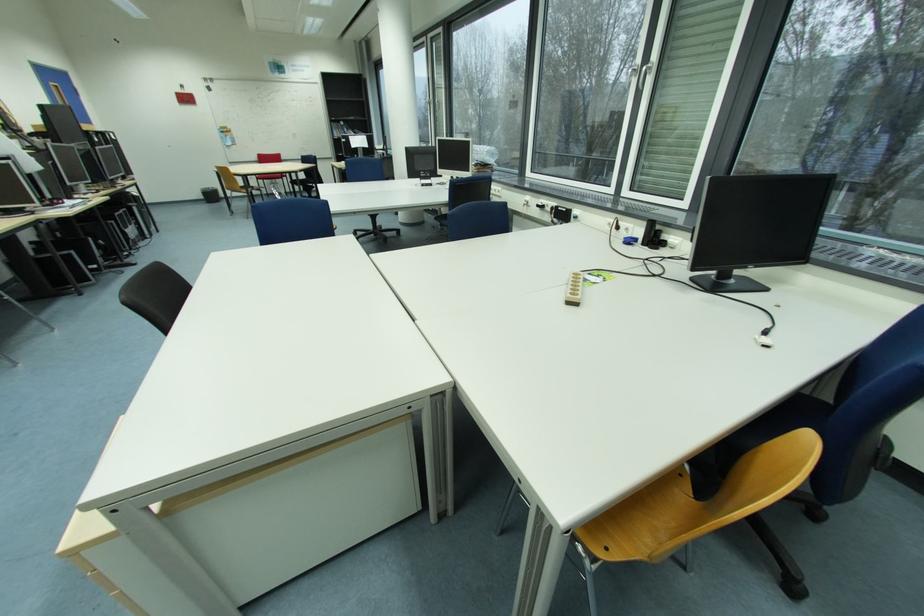
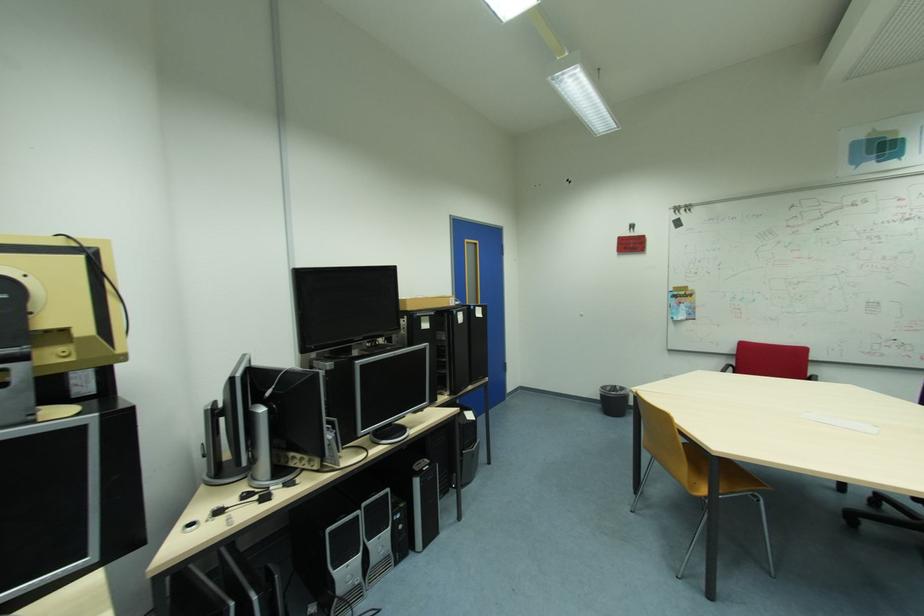
In the second image, find the point that corresponds to [103,140] in the first image.

(432, 326)